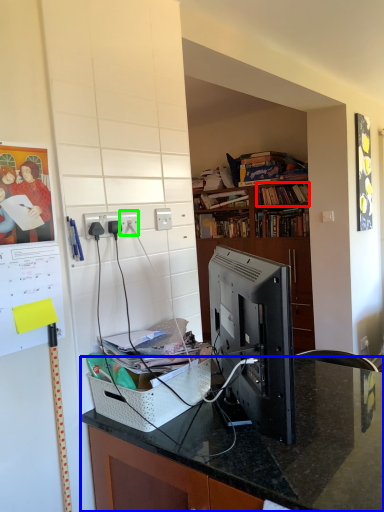
Question: Which object is positioned farthest from book (highlighted by a red box)? Select from desk (highlighted by a blue box) and electric outlet (highlighted by a green box).

Choices:
 (A) desk
 (B) electric outlet

Answer: (A)